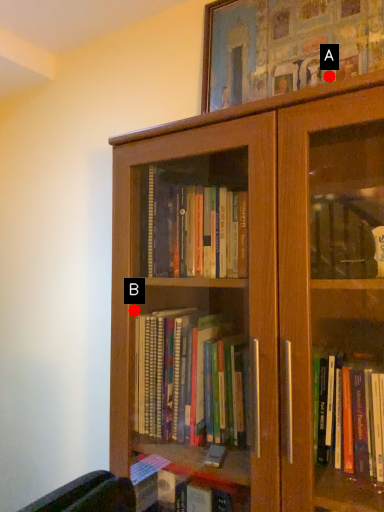
Question: Two points are circled on the image, labeled by A and B beside each circle. Among these points, which one is nearest to the camera?

Choices:
 (A) A is closer
 (B) B is closer

Answer: (A)